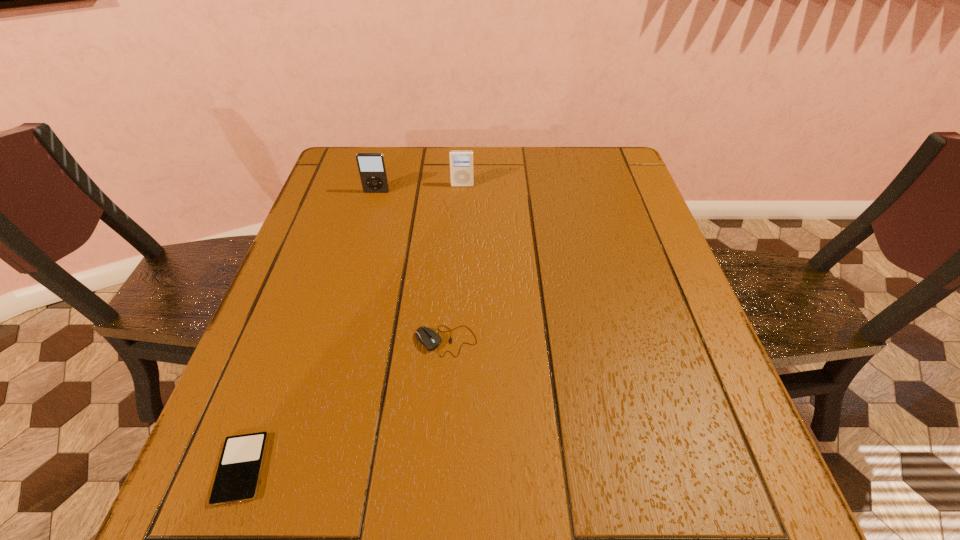
Where is `blank region between the leftmost object and the second farthest object`? blank region between the leftmost object and the second farthest object is located at coordinates (309, 330).

Point out which object is positioned as the third nearest to the leftmost iPod. Please provide its 2D coordinates. Your answer should be formatted as a tuple, i.e. [(x, y)], where the tuple contains the x and y coordinates of a point satisfying the conditions above.

[(461, 161)]

The image size is (960, 540). What are the coordinates of `object that is the closest to the computer mouse` in the screenshot? It's located at (238, 474).

I want to click on iPod that is the nearest to the nearest iPod, so click(x=371, y=166).

At what (x,y) coordinates should I click in order to perform the action: click on iPod that is the second closest one to the nearest object. Please return your answer as a coordinate pair (x, y). This screenshot has width=960, height=540. Looking at the image, I should click on (461, 161).

The height and width of the screenshot is (540, 960). What are the coordinates of `free location that satisfies the following two spatial constraints: 1. on the front-facing side of the third tallest object; 2. on the left side of the second iPod from right to left` in the screenshot? It's located at (335, 341).

Image resolution: width=960 pixels, height=540 pixels. I want to click on vacant space that satisfies the following two spatial constraints: 1. on the front-facing side of the third farthest object; 2. on the left side of the second farthest iPod, so click(x=335, y=341).